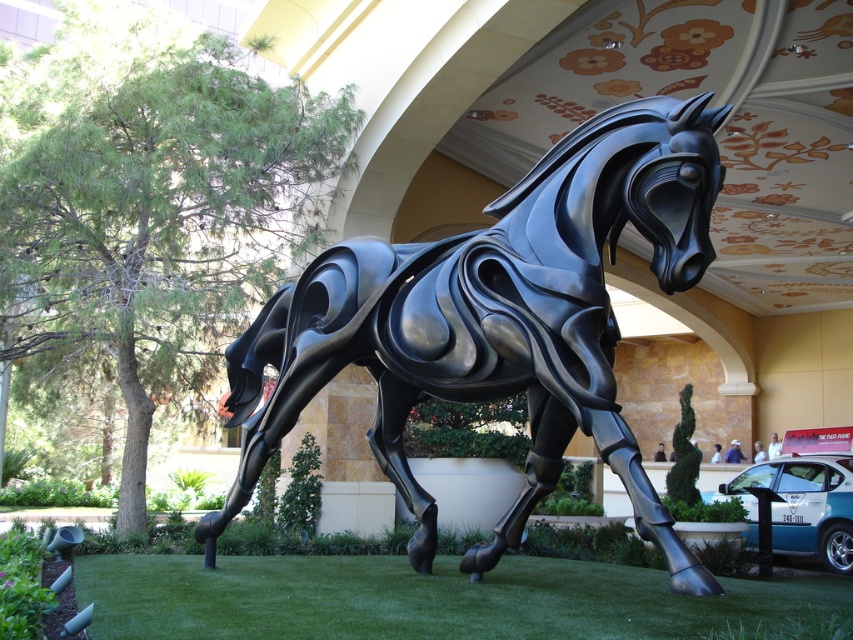
Who is positioned more to the left, glossy black horse at center or green grass at lower center?

green grass at lower center is more to the left.

You are a GUI agent. You are given a task and a screenshot of the screen. Output one action in this format:
    pyautogui.click(x=<x>, y=<y>)
    Task: Click on the glossy black horse at center
    
    Given the screenshot: What is the action you would take?
    click(x=496, y=321)

Describe the element at coordinates (496, 321) in the screenshot. I see `glossy black horse at center` at that location.

The width and height of the screenshot is (853, 640). I want to click on glossy black horse at center, so click(x=496, y=321).